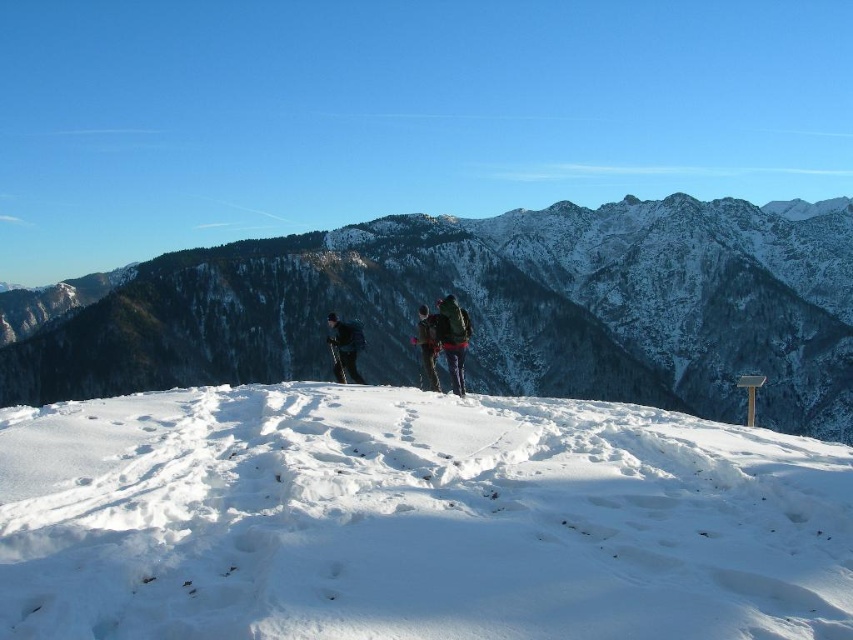
Question: Does white snow at center appear under dark green fabric jacket at center?

Choices:
 (A) yes
 (B) no

Answer: (A)

Question: Which point is farther from the camera taking this photo?

Choices:
 (A) (437, 378)
 (B) (331, 321)
 (C) (444, 310)

Answer: (B)

Question: Is dark green fabric jacket at center thinner than black fabric jacket at center?

Choices:
 (A) yes
 (B) no

Answer: (A)

Question: Which point appears closest to the camera in this image?

Choices:
 (A) (780, 396)
 (B) (421, 308)
 (C) (345, 369)

Answer: (C)

Question: Is white snow at center to the left of dark gray fabric jacket at center from the viewer's perspective?

Choices:
 (A) yes
 (B) no

Answer: (B)

Question: Which point is closer to the camera?

Choices:
 (A) (436, 339)
 (B) (453, 390)

Answer: (B)